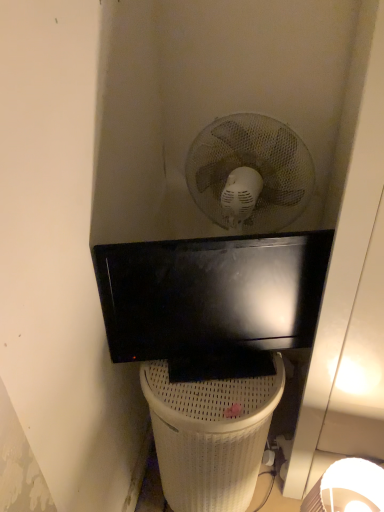
Question: In the image, is white woven trash bin/can at lower center on the left side or the right side of black glossy television at center?

Choices:
 (A) right
 (B) left

Answer: (B)

Question: Is white woven trash bin/can at lower center in front of or behind black glossy television at center in the image?

Choices:
 (A) behind
 (B) front

Answer: (A)

Question: Based on their sizes in the image, would you say white woven trash bin/can at lower center is bigger or smaller than black glossy television at center?

Choices:
 (A) big
 (B) small

Answer: (A)

Question: Considering their positions, is black glossy television at center located in front of or behind white woven trash bin/can at lower center?

Choices:
 (A) front
 (B) behind

Answer: (A)

Question: Is point (109, 245) positioned closer to the camera than point (221, 448)?

Choices:
 (A) closer
 (B) farther

Answer: (A)

Question: From the image's perspective, is black glossy television at center above or below white woven trash bin/can at lower center?

Choices:
 (A) below
 (B) above

Answer: (B)

Question: From a real-world perspective, is black glossy television at center positioned above or below white woven trash bin/can at lower center?

Choices:
 (A) below
 (B) above

Answer: (B)